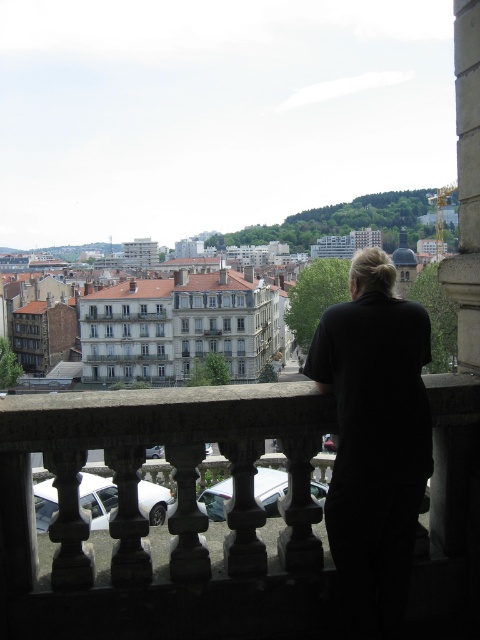
Does stone balustrade at center lie behind black fabric at center?

No, it is in front of black fabric at center.

The image size is (480, 640). What do you see at coordinates (168, 518) in the screenshot?
I see `stone balustrade at center` at bounding box center [168, 518].

The height and width of the screenshot is (640, 480). What are the coordinates of `stone balustrade at center` in the screenshot? It's located at (168, 518).